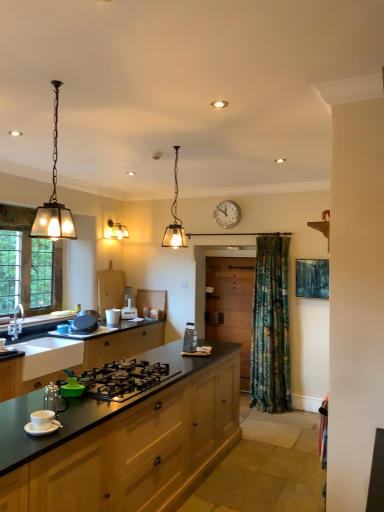
You are a GUI agent. You are given a task and a screenshot of the screen. Output one action in this format:
    pyautogui.click(x=<x>, y=<y>)
    Task: Click on the blank space situated above black matte gas stove at center (from a real-world perspective)
    Image resolution: width=384 pixels, height=512 pixels.
    Given the screenshot: What is the action you would take?
    pyautogui.click(x=114, y=370)